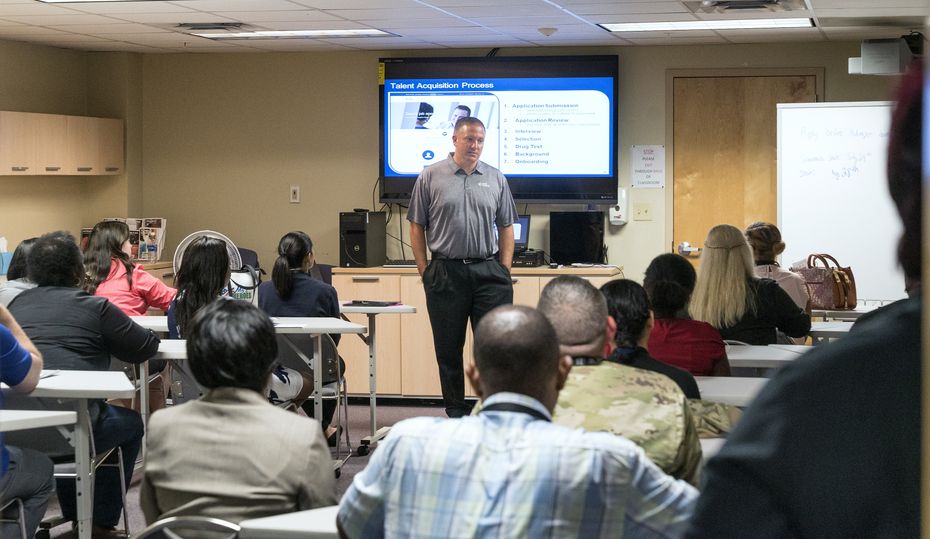
The width and height of the screenshot is (930, 539). I want to click on computer box, so click(583, 241), click(373, 243).